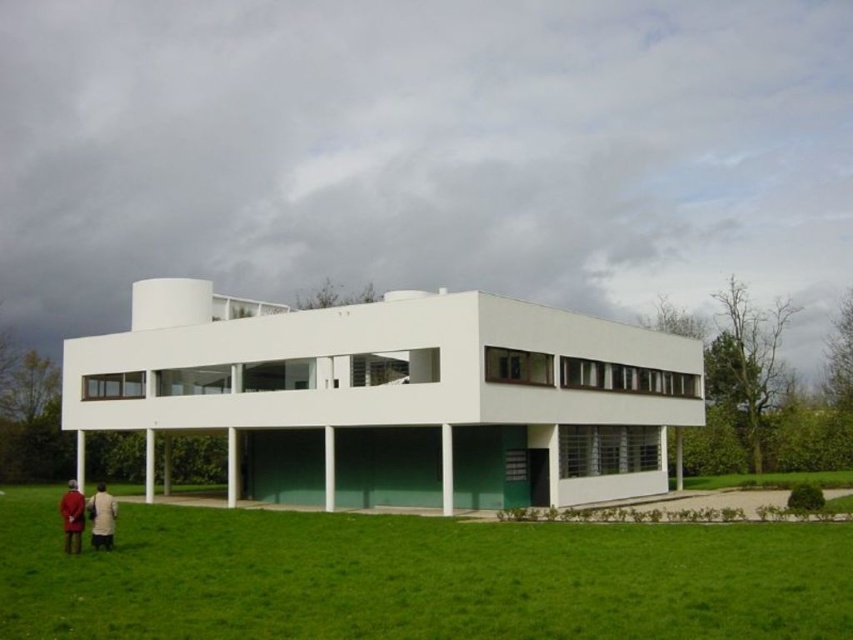
Question: Where is matte red coat at lower left located in relation to red wool coat at lower left in the image?

Choices:
 (A) right
 (B) left

Answer: (A)

Question: Does matte red coat at lower left appear on the right side of red wool coat at lower left?

Choices:
 (A) yes
 (B) no

Answer: (A)

Question: Based on their relative distances, which object is nearer to the light beige coat at lower left?

Choices:
 (A) matte red coat at lower left
 (B) green grass at lower left

Answer: (A)

Question: Can you confirm if matte red coat at lower left is positioned to the left of red wool coat at lower left?

Choices:
 (A) no
 (B) yes

Answer: (A)

Question: Which of the following is the closest to the observer?

Choices:
 (A) red wool coat at lower left
 (B) green grass at lower left

Answer: (B)

Question: Which object is positioned farthest from the light beige coat at lower left?

Choices:
 (A) green grass at lower left
 (B) red wool coat at lower left
 (C) matte red coat at lower left

Answer: (A)